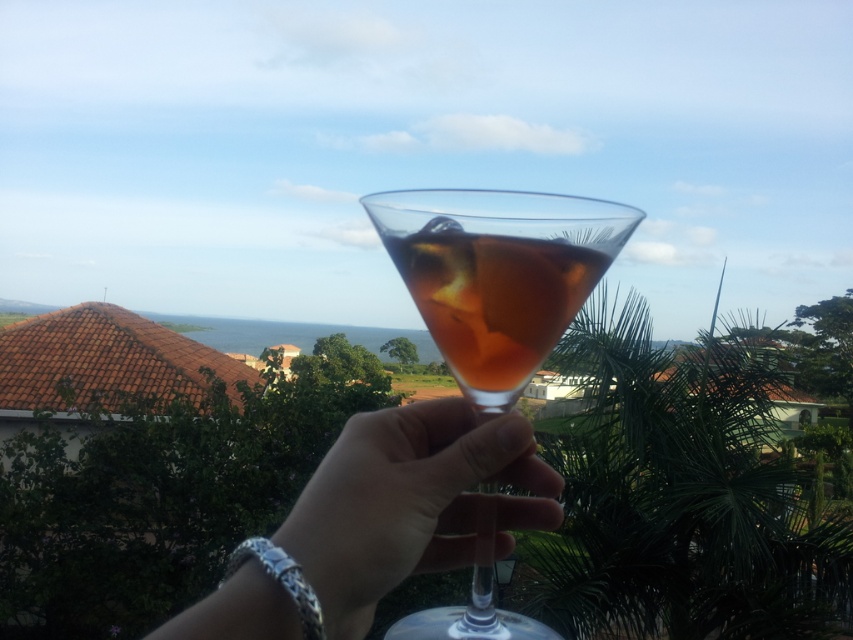
Question: Is clear glass at center positioned in front of translucent glass drink at center?

Choices:
 (A) yes
 (B) no

Answer: (A)

Question: Which is nearer to the translucent glass drink at center?

Choices:
 (A) translucent glass cocktail at center
 (B) clear glass at center

Answer: (A)

Question: Estimate the real-world distances between objects in this image. Which object is farther from the translucent glass drink at center?

Choices:
 (A) clear glass at center
 (B) translucent glass cocktail at center

Answer: (A)

Question: Is translucent glass cocktail at center closer to camera compared to clear glass at center?

Choices:
 (A) yes
 (B) no

Answer: (B)

Question: Is the position of clear glass at center more distant than that of translucent glass drink at center?

Choices:
 (A) yes
 (B) no

Answer: (B)

Question: Among these points, which one is nearest to the camera?

Choices:
 (A) (306, 540)
 (B) (432, 268)

Answer: (A)